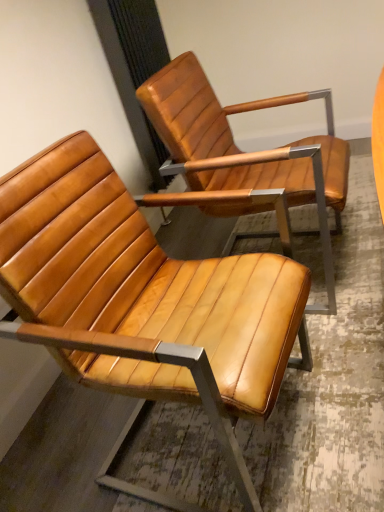
Question: Considering the relative positions of matte leather chair at center, the second chair from the back, and matte brown leather chair at upper right, the 1th chair in the back-to-front sequence, in the image provided, is matte leather chair at center, the second chair from the back, to the right of matte brown leather chair at upper right, the 1th chair in the back-to-front sequence, from the viewer's perspective?

Choices:
 (A) no
 (B) yes

Answer: (A)

Question: Does matte leather chair at center, arranged as the first chair when viewed from the front, come behind matte brown leather chair at upper right, the 1th chair in the back-to-front sequence?

Choices:
 (A) yes
 (B) no

Answer: (B)

Question: Is matte leather chair at center, arranged as the first chair when viewed from the front, bigger than matte brown leather chair at upper right, the 1th chair in the back-to-front sequence?

Choices:
 (A) no
 (B) yes

Answer: (A)

Question: From the image's perspective, does matte leather chair at center, arranged as the first chair when viewed from the front, appear lower than matte brown leather chair at upper right, the 1th chair in the back-to-front sequence?

Choices:
 (A) yes
 (B) no

Answer: (A)

Question: Is matte leather chair at center, arranged as the first chair when viewed from the front, facing towards matte brown leather chair at upper right, the second chair positioned from the front?

Choices:
 (A) no
 (B) yes

Answer: (A)

Question: From a real-world perspective, is matte leather chair at center, arranged as the first chair when viewed from the front, positioned over matte brown leather chair at upper right, the second chair positioned from the front, based on gravity?

Choices:
 (A) yes
 (B) no

Answer: (B)

Question: Is matte brown leather chair at upper right, the 1th chair in the back-to-front sequence, positioned in front of matte leather chair at center, the second chair from the back?

Choices:
 (A) no
 (B) yes

Answer: (A)

Question: Is matte brown leather chair at upper right, the 1th chair in the back-to-front sequence, oriented towards matte leather chair at center, arranged as the first chair when viewed from the front?

Choices:
 (A) yes
 (B) no

Answer: (B)

Question: Is matte brown leather chair at upper right, the second chair positioned from the front, next to matte leather chair at center, arranged as the first chair when viewed from the front, and touching it?

Choices:
 (A) no
 (B) yes

Answer: (A)

Question: Considering the relative sizes of matte brown leather chair at upper right, the second chair positioned from the front, and matte leather chair at center, arranged as the first chair when viewed from the front, in the image provided, is matte brown leather chair at upper right, the second chair positioned from the front, taller than matte leather chair at center, arranged as the first chair when viewed from the front,?

Choices:
 (A) yes
 (B) no

Answer: (A)

Question: Is matte leather chair at center, arranged as the first chair when viewed from the front, at the back of matte brown leather chair at upper right, the second chair positioned from the front?

Choices:
 (A) yes
 (B) no

Answer: (B)

Question: Is matte brown leather chair at upper right, the second chair positioned from the front, outside matte leather chair at center, the second chair from the back?

Choices:
 (A) yes
 (B) no

Answer: (A)

Question: From the image's perspective, is matte leather chair at center, the second chair from the back, located above or below matte brown leather chair at upper right, the second chair positioned from the front?

Choices:
 (A) below
 (B) above

Answer: (A)